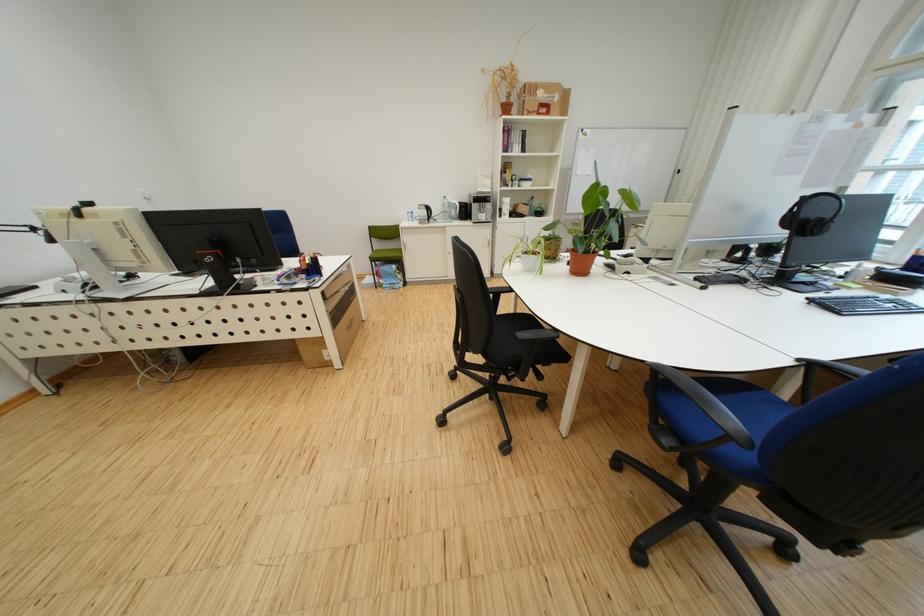
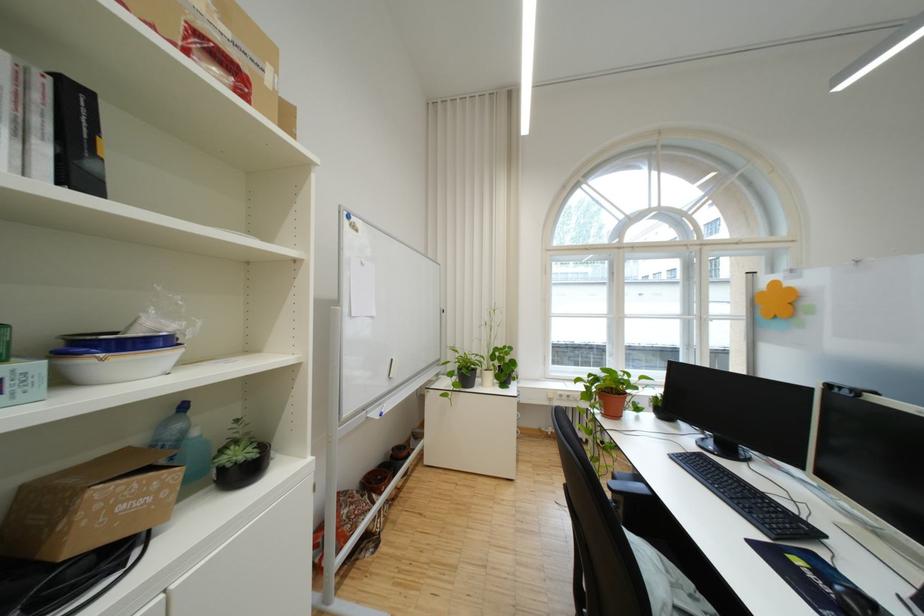
Locate, in the second image, the point that corresponds to pixel 536 136 in the first image.

(88, 100)